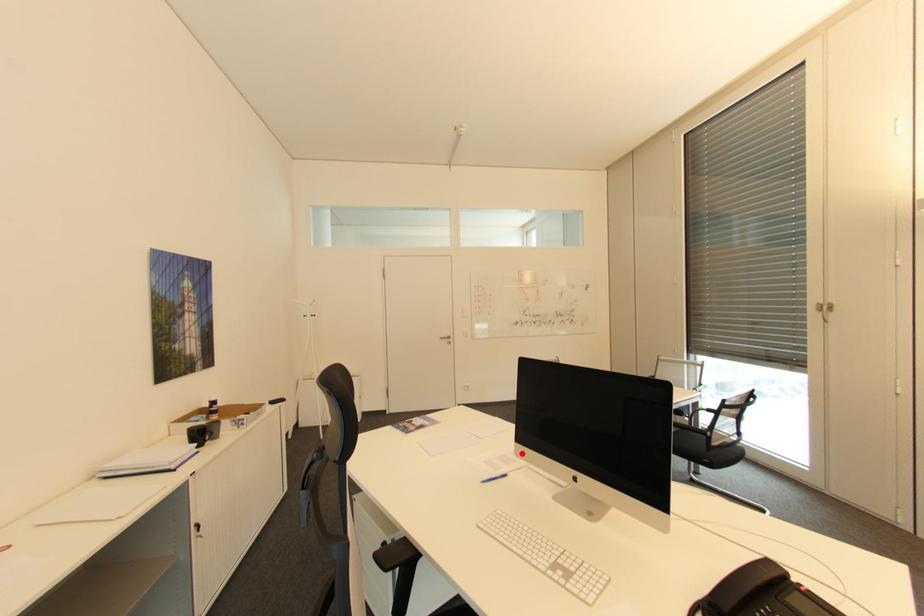
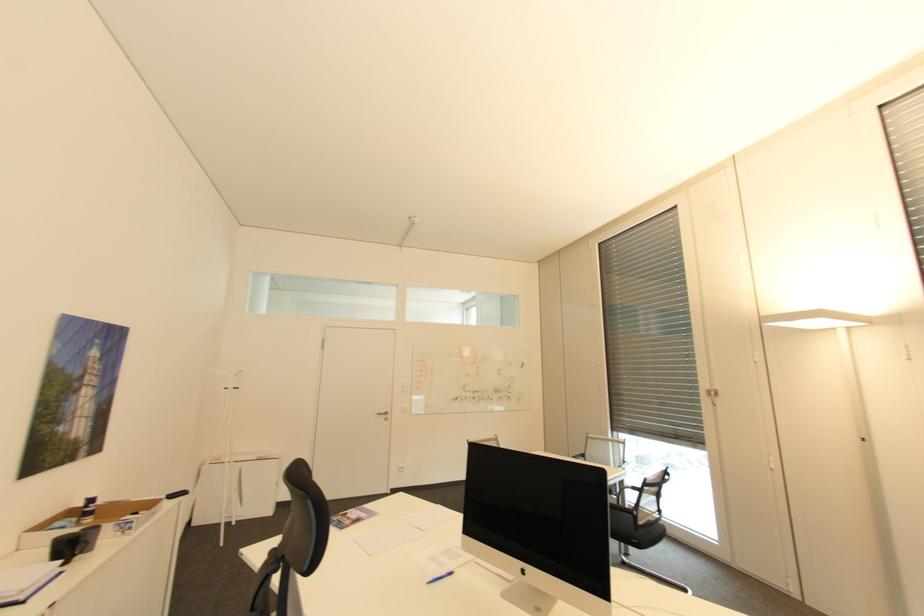
Where in the second image is the point corresponding to the highlighted location from the first image?

(468, 546)